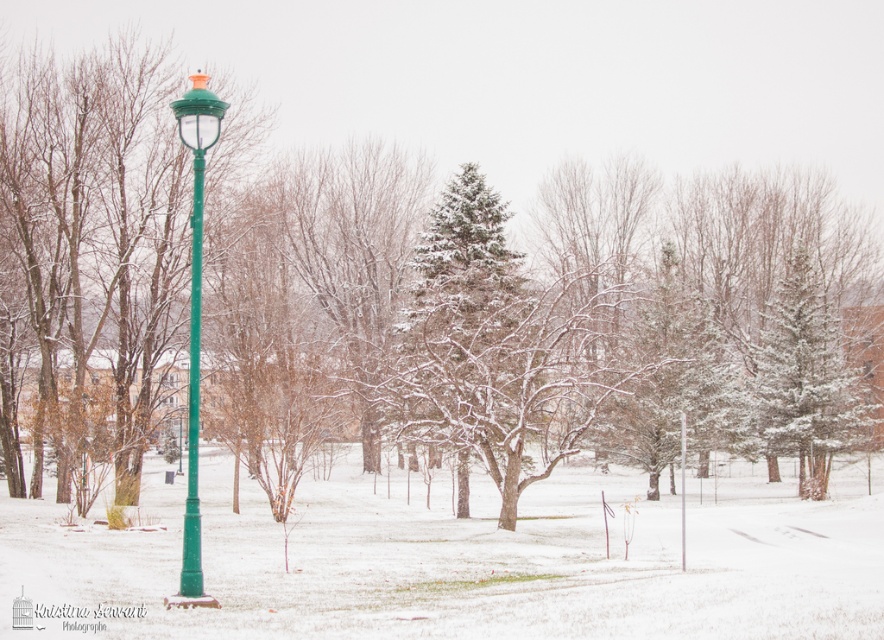
Question: Which of the following is the farthest from the observer?

Choices:
 (A) (193, 307)
 (B) (682, 508)

Answer: (B)

Question: Can you confirm if green matte street light at left is positioned above green plastic pole at center?

Choices:
 (A) no
 (B) yes

Answer: (B)

Question: Which of these objects is positioned closest to the green matte street light at left?

Choices:
 (A) green plastic pole at center
 (B) green matte pole at left

Answer: (B)

Question: Can you confirm if green matte street light at left is smaller than green plastic pole at center?

Choices:
 (A) yes
 (B) no

Answer: (A)

Question: Is green matte pole at left smaller than green plastic pole at center?

Choices:
 (A) no
 (B) yes

Answer: (B)

Question: Which point is farther to the camera?

Choices:
 (A) green matte pole at left
 (B) green plastic pole at center
 (C) green matte street light at left

Answer: (B)